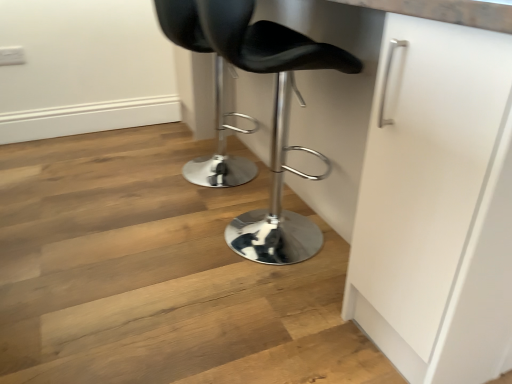
Question: Is black leather stool at center, the first chair when ordered from back to front, inside the boundaries of black leather stool at center, the first chair in the front-to-back sequence, or outside?

Choices:
 (A) inside
 (B) outside

Answer: (B)

Question: Considering their positions, is black leather stool at center, the 2th chair positioned from the front, located in front of or behind black leather stool at center, which is counted as the 2th chair, starting from the back?

Choices:
 (A) front
 (B) behind

Answer: (B)

Question: Is black leather stool at center, the first chair when ordered from back to front, taller or shorter than black leather stool at center, which is counted as the 2th chair, starting from the back?

Choices:
 (A) tall
 (B) short

Answer: (B)

Question: In terms of height, does black leather stool at center, which is counted as the 2th chair, starting from the back, look taller or shorter compared to black leather stool at center, the first chair when ordered from back to front?

Choices:
 (A) short
 (B) tall

Answer: (B)

Question: From the image's perspective, relative to black leather stool at center, the 2th chair positioned from the front, is black leather stool at center, which is counted as the 2th chair, starting from the back, above or below?

Choices:
 (A) below
 (B) above

Answer: (A)

Question: Looking at their shapes, would you say black leather stool at center, which is counted as the 2th chair, starting from the back, is wider or thinner than black leather stool at center, the 2th chair positioned from the front?

Choices:
 (A) wide
 (B) thin

Answer: (A)

Question: In the image, is black leather stool at center, which is counted as the 2th chair, starting from the back, positioned in front of or behind black leather stool at center, the 2th chair positioned from the front?

Choices:
 (A) behind
 (B) front

Answer: (B)